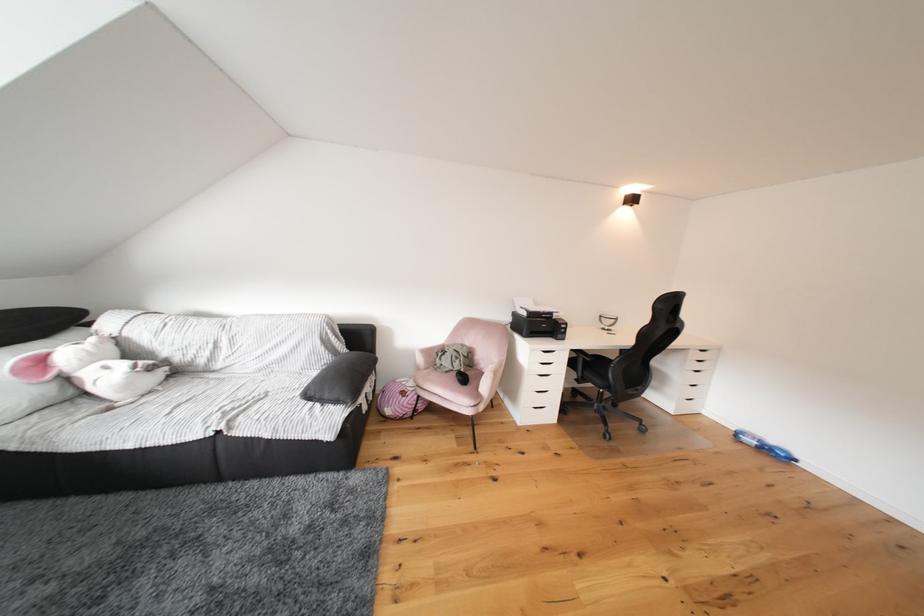
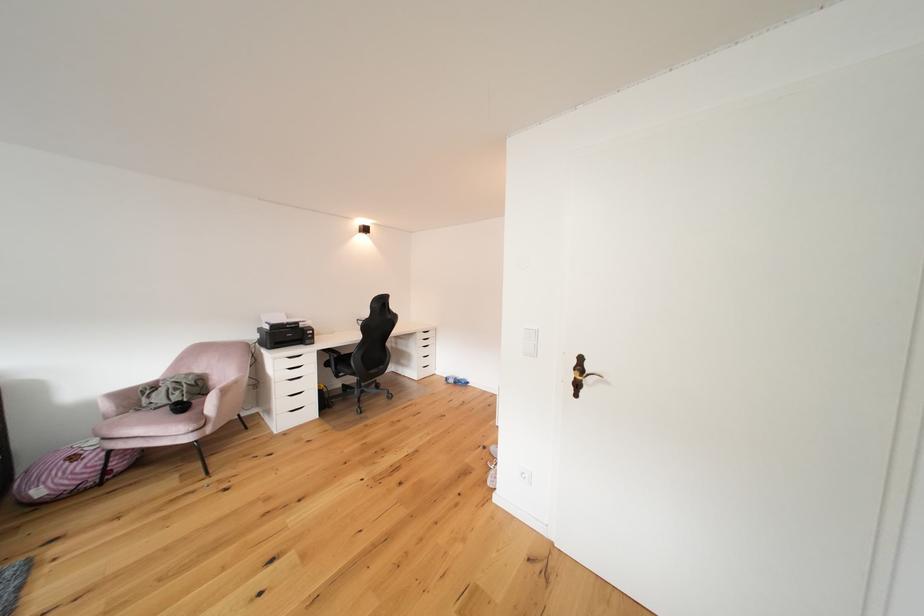
Where in the second image is the point corresponding to point 592,367 from the first image?

(343, 363)